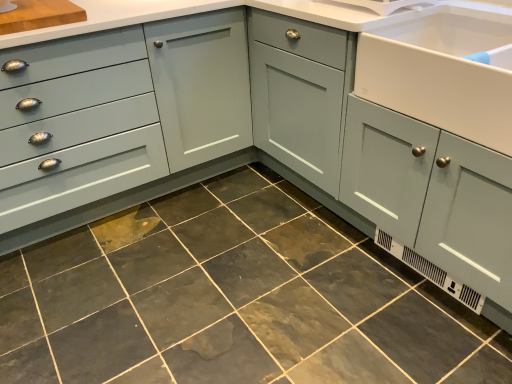
Question: Is matte gray drawer at left to the left of dark gray stone tile at center from the viewer's perspective?

Choices:
 (A) no
 (B) yes

Answer: (B)

Question: Considering the relative positions of matte gray drawer at left and dark gray stone tile at center in the image provided, is matte gray drawer at left to the right of dark gray stone tile at center from the viewer's perspective?

Choices:
 (A) no
 (B) yes

Answer: (A)

Question: Is matte gray drawer at left shorter than dark gray stone tile at center?

Choices:
 (A) no
 (B) yes

Answer: (A)

Question: Is matte gray drawer at left positioned with its back to dark gray stone tile at center?

Choices:
 (A) no
 (B) yes

Answer: (A)

Question: Is the surface of matte gray drawer at left in direct contact with dark gray stone tile at center?

Choices:
 (A) no
 (B) yes

Answer: (A)

Question: Based on their positions, is dark gray stone tile at center located to the left or right of white glossy sink at right?

Choices:
 (A) left
 (B) right

Answer: (A)

Question: Does point (198, 213) appear closer or farther from the camera than point (494, 23)?

Choices:
 (A) closer
 (B) farther

Answer: (B)

Question: From the image's perspective, is dark gray stone tile at center positioned above or below white glossy sink at right?

Choices:
 (A) above
 (B) below

Answer: (B)

Question: From a real-world perspective, is dark gray stone tile at center positioned above or below white glossy sink at right?

Choices:
 (A) below
 (B) above

Answer: (A)

Question: From the image's perspective, is white glossy sink at right above or below matte gray drawer at left?

Choices:
 (A) above
 (B) below

Answer: (A)

Question: From a real-world perspective, is white glossy sink at right above or below matte gray drawer at left?

Choices:
 (A) below
 (B) above

Answer: (B)

Question: In the image, is white glossy sink at right on the left side or the right side of matte gray drawer at left?

Choices:
 (A) left
 (B) right

Answer: (B)

Question: Relative to matte gray drawer at left, is white glossy sink at right in front or behind?

Choices:
 (A) front
 (B) behind

Answer: (A)

Question: In terms of size, does white glossy sink at right appear bigger or smaller than dark gray stone tile at center?

Choices:
 (A) small
 (B) big

Answer: (A)

Question: In the image, is white glossy sink at right positioned in front of or behind dark gray stone tile at center?

Choices:
 (A) behind
 (B) front

Answer: (A)